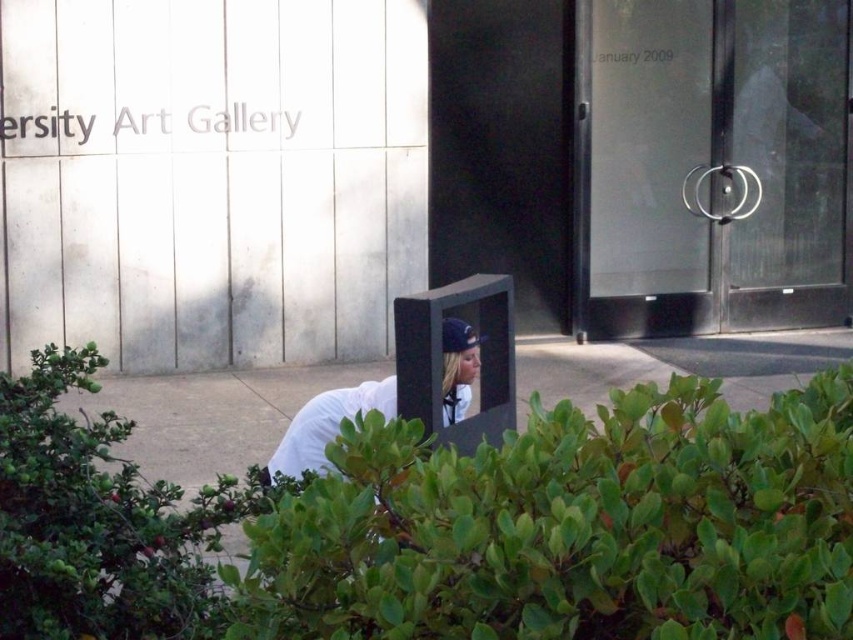
You are standing at the entrance of the Art Gallery and want to enter. The transparent glass door at center right is your only option. Can you walk through it?

The transparent glass door at center right is at point (718, 163), so yes, you can walk through it as it is positioned at that coordinate which is accessible for entry.

You are an art gallery security guard who notices a person in the scene. There is a green leafy bush at lower left and a white matte shirt at lower center. Which object is closer to the left edge of the image?

The green leafy bush at lower left is positioned on the left side of white matte shirt at lower center, so it is closer to the left edge of the image.

You are standing at the entrance of the Art Gallery. You see a point marked at coordinates (718,163). What does this point indicate?

The point at coordinates (718,163) marks the transparent glass door at center right.